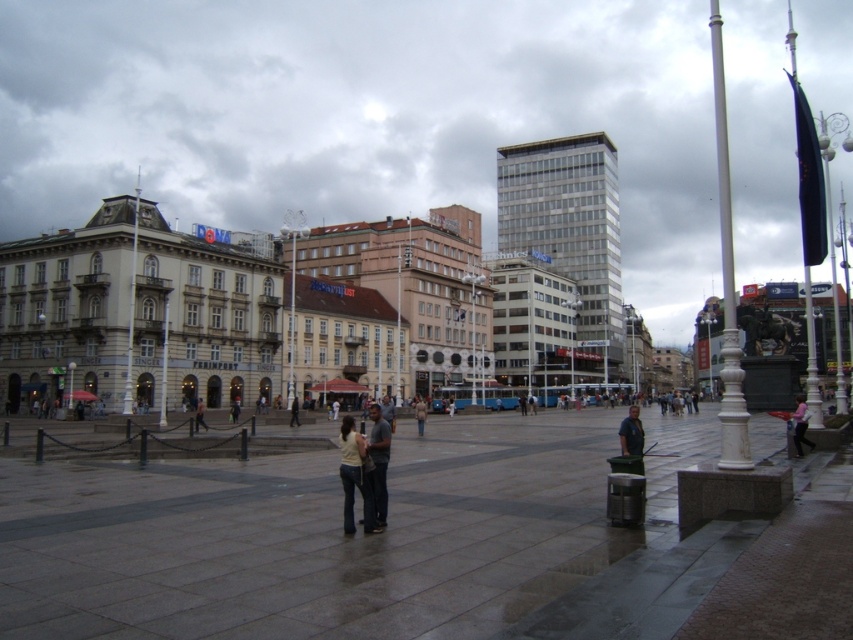
Question: Considering the real-world distances, which object is closest to the denim pants at center?

Choices:
 (A) light beige coat at center
 (B) dark gray pants at center

Answer: (B)

Question: Is light beige jeans at center behind dark gray jeans at center?

Choices:
 (A) no
 (B) yes

Answer: (A)

Question: Which point is closer to the camera taking this photo?

Choices:
 (A) (207, 426)
 (B) (349, 509)
 (C) (808, 442)
 (D) (296, 396)

Answer: (B)

Question: Is denim pants at center closer to camera compared to dark gray pants at center?

Choices:
 (A) yes
 (B) no

Answer: (A)

Question: Observing the image, what is the correct spatial positioning of light beige jeans at center in reference to pink fabric at lower right?

Choices:
 (A) below
 (B) above

Answer: (A)

Question: Which point appears farthest from the camera in this image?

Choices:
 (A) (376, 476)
 (B) (625, 428)
 (C) (805, 404)

Answer: (C)